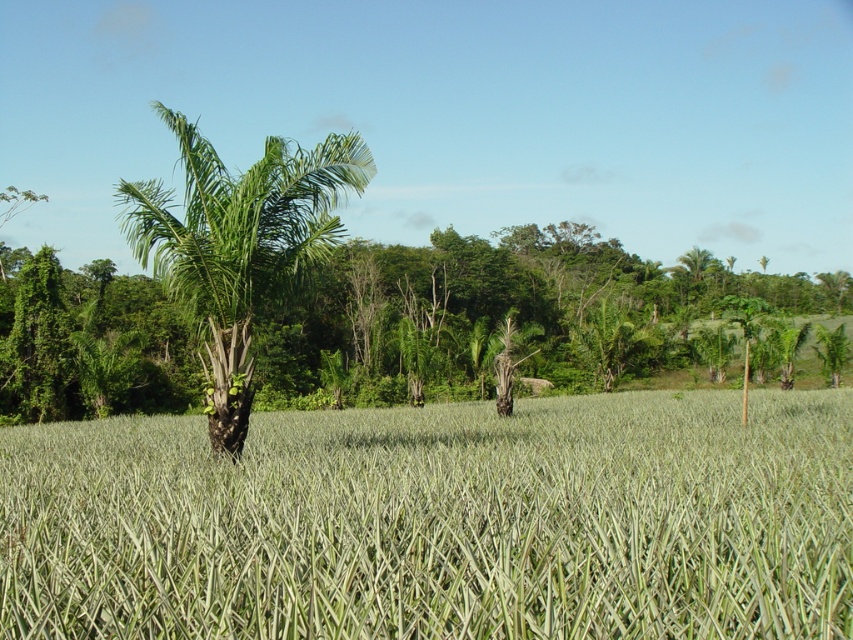
Question: Which point is closer to the camera?

Choices:
 (A) (256, 630)
 (B) (276, 196)

Answer: (A)

Question: Can you confirm if green grassy wheat field at center is wider than green leafy palm tree at center?

Choices:
 (A) yes
 (B) no

Answer: (B)

Question: Can you confirm if green grassy wheat field at center is positioned below green leafy palm tree at center?

Choices:
 (A) yes
 (B) no

Answer: (A)

Question: Can you confirm if green grassy wheat field at center is thinner than green leafy palm tree at center?

Choices:
 (A) yes
 (B) no

Answer: (A)

Question: Which point appears closest to the camera in this image?

Choices:
 (A) (154, 579)
 (B) (204, 340)

Answer: (A)